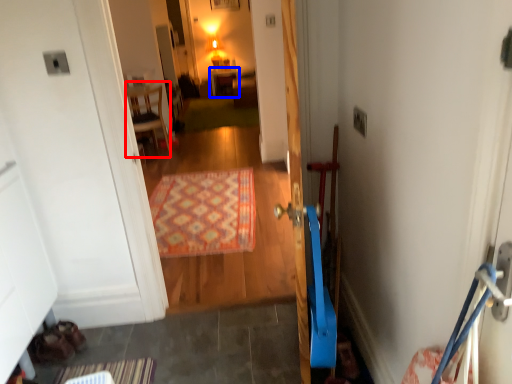
Question: Which point is closer to the camera, furniture (highlighted by a red box) or furniture (highlighted by a blue box)?

Choices:
 (A) furniture
 (B) furniture

Answer: (A)